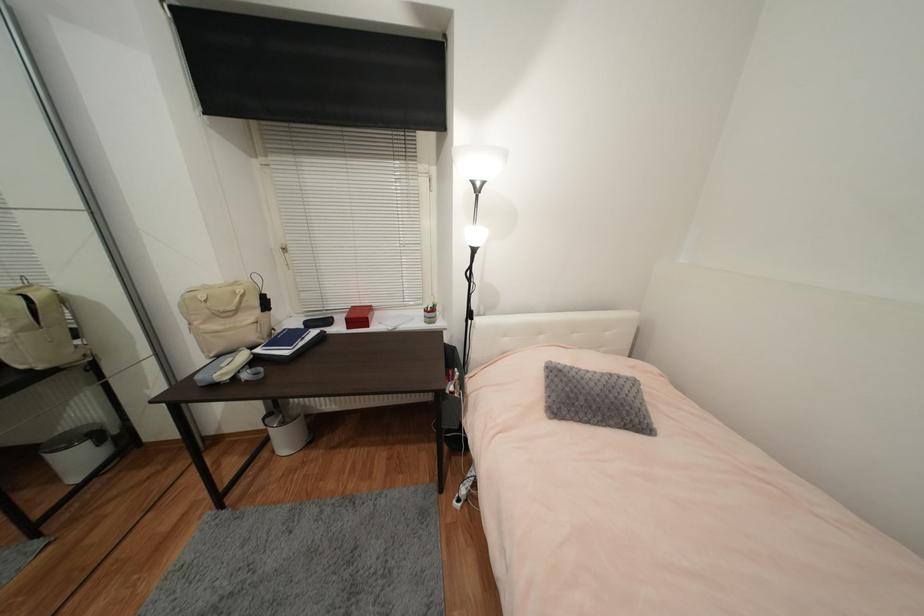
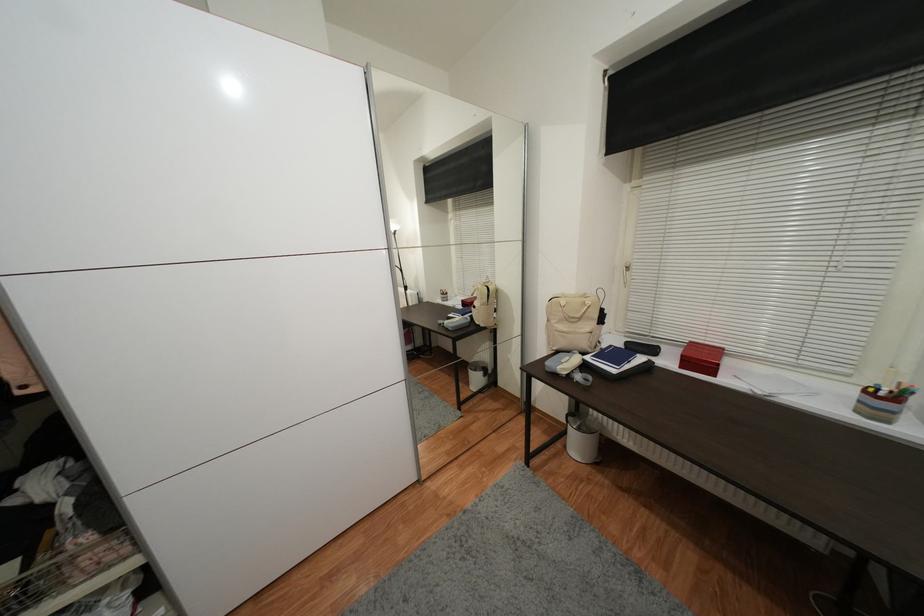
Find the pixel in the second image that matches [238,294] in the first image.

(589, 305)